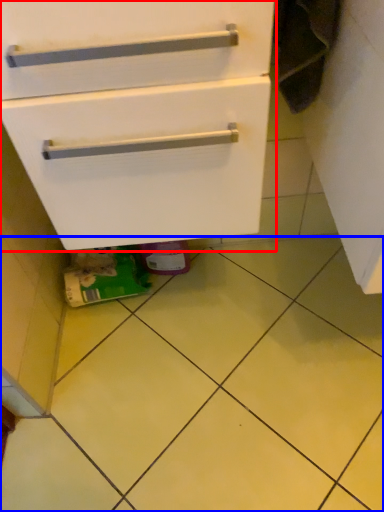
Question: Among these objects, which one is farthest to the camera, cabinetry (highlighted by a red box) or ceramic tile (highlighted by a blue box)?

Choices:
 (A) cabinetry
 (B) ceramic tile

Answer: (B)